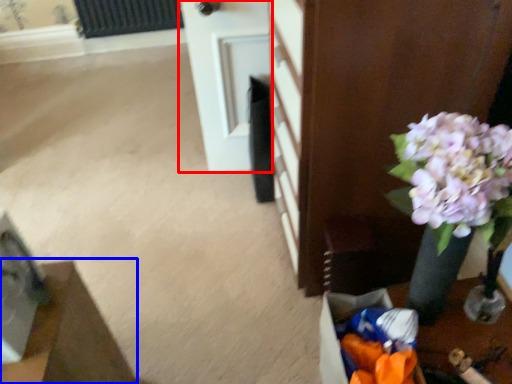
Question: Which of the following is the closest to the observer, door (highlighted by a red box) or furniture (highlighted by a blue box)?

Choices:
 (A) door
 (B) furniture

Answer: (B)